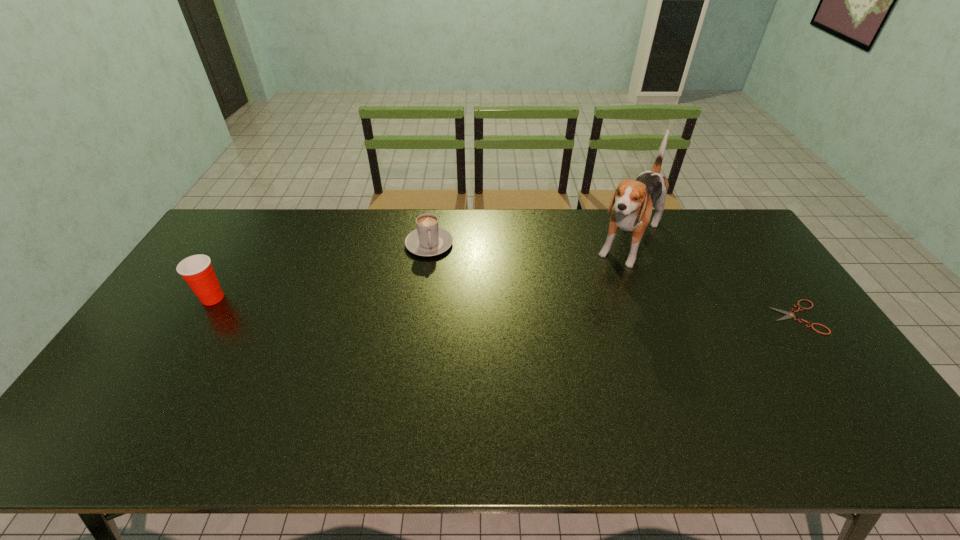
At what (x,y) coordinates should I click in order to perform the action: click on blank region between the leftmost object and the rightmost object. Please return your answer as a coordinate pair (x, y). Image resolution: width=960 pixels, height=540 pixels. Looking at the image, I should click on (505, 307).

Where is `free spot between the second shortest object and the shears`? This screenshot has width=960, height=540. free spot between the second shortest object and the shears is located at coordinates (613, 280).

Where is `vacant area that lies between the third shortest object and the tallest object`? This screenshot has width=960, height=540. vacant area that lies between the third shortest object and the tallest object is located at coordinates (421, 271).

You are a GUI agent. You are given a task and a screenshot of the screen. Output one action in this format:
    pyautogui.click(x=<x>, y=<y>)
    Task: Click on the vacant area that lies between the Dixie cup and the rightmost object
    
    Given the screenshot: What is the action you would take?
    click(505, 307)

Find the location of a particular element. The width and height of the screenshot is (960, 540). vacant region between the leftmost object and the rightmost object is located at coordinates pos(505,307).

Where is `empty space that is in between the rightmost object and the second object from right to left`? empty space that is in between the rightmost object and the second object from right to left is located at coordinates (713, 280).

Locate an element on the screen. object that can be found as the third closest to the rightmost object is located at coordinates (197, 270).

Select which object is the second closest to the puppy. Please provide its 2D coordinates. Your answer should be formatted as a tuple, i.e. [(x, y)], where the tuple contains the x and y coordinates of a point satisfying the conditions above.

[(429, 239)]

Find the location of a particular element. free space that satisfies the following two spatial constraints: 1. on the front side of the rightmost object; 2. on the left side of the puppy is located at coordinates (659, 317).

Identify the location of vacant region that satisfies the following two spatial constraints: 1. on the back side of the leftmost object; 2. on the right side of the second object from left to right. The height and width of the screenshot is (540, 960). (246, 244).